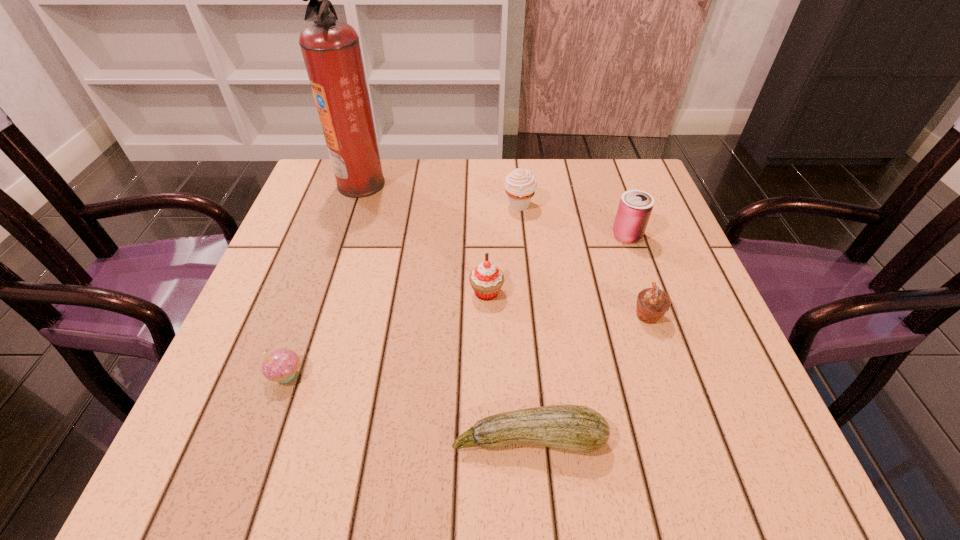
Locate an element on the screen. Image resolution: width=960 pixels, height=540 pixels. fire extinguisher that is at the left edge is located at coordinates (331, 50).

Locate an element on the screen. The width and height of the screenshot is (960, 540). cupcake at the left edge is located at coordinates (281, 365).

You are a GUI agent. You are given a task and a screenshot of the screen. Output one action in this format:
    pyautogui.click(x=<x>, y=<y>)
    Task: Click on the can at the right edge
    This screenshot has width=960, height=540.
    Given the screenshot: What is the action you would take?
    pyautogui.click(x=635, y=207)

Where is `muffin that is at the right edge`? muffin that is at the right edge is located at coordinates (652, 303).

In order to click on object situated at the far left corner in this screenshot , I will do `click(331, 50)`.

Find the location of a particular element. Image resolution: width=960 pixels, height=540 pixels. free region at the far edge of the desktop is located at coordinates (550, 209).

Where is `free space at the near edge`? The image size is (960, 540). free space at the near edge is located at coordinates (348, 472).

You are a GUI agent. You are given a task and a screenshot of the screen. Output one action in this format:
    pyautogui.click(x=<x>, y=<y>)
    Task: Click on the free space at the left edge
    The image size is (960, 540).
    Given the screenshot: What is the action you would take?
    pyautogui.click(x=312, y=223)

In the image, there is a desktop. In order to click on vacant space at the right edge in this screenshot , I will do `click(667, 267)`.

Locate an element on the screen. This screenshot has width=960, height=540. vacant position at the near left corner of the desktop is located at coordinates (251, 441).